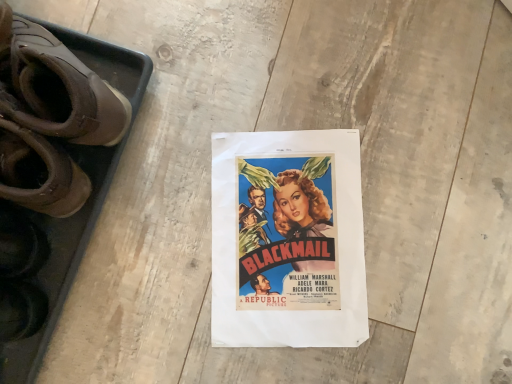
Question: Considering the relative positions of vivid paper poster at center and brown leather shoes at left in the image provided, is vivid paper poster at center to the right of brown leather shoes at left from the viewer's perspective?

Choices:
 (A) yes
 (B) no

Answer: (A)

Question: Can you confirm if vivid paper poster at center is taller than brown leather shoes at left?

Choices:
 (A) no
 (B) yes

Answer: (A)

Question: From a real-world perspective, is vivid paper poster at center under brown leather shoes at left?

Choices:
 (A) yes
 (B) no

Answer: (A)

Question: Is vivid paper poster at center next to brown leather shoes at left?

Choices:
 (A) yes
 (B) no

Answer: (B)

Question: Can you confirm if vivid paper poster at center is positioned to the left of brown leather shoes at left?

Choices:
 (A) no
 (B) yes

Answer: (A)

Question: Is vivid paper poster at center positioned behind brown leather shoes at left?

Choices:
 (A) no
 (B) yes

Answer: (B)

Question: From a real-world perspective, is brown leather shoes at left on top of vivid paper poster at center?

Choices:
 (A) no
 (B) yes

Answer: (B)

Question: Can vivid paper poster at center be found inside brown leather shoes at left?

Choices:
 (A) no
 (B) yes

Answer: (A)

Question: Is vivid paper poster at center at the back of brown leather shoes at left?

Choices:
 (A) yes
 (B) no

Answer: (A)

Question: From a real-world perspective, is brown leather shoes at left located beneath vivid paper poster at center?

Choices:
 (A) yes
 (B) no

Answer: (B)

Question: Can you confirm if brown leather shoes at left is wider than vivid paper poster at center?

Choices:
 (A) yes
 (B) no

Answer: (B)

Question: Does brown leather shoes at left have a greater height compared to vivid paper poster at center?

Choices:
 (A) yes
 (B) no

Answer: (A)

Question: Considering their positions, is vivid paper poster at center located in front of or behind brown leather shoes at left?

Choices:
 (A) behind
 (B) front

Answer: (A)